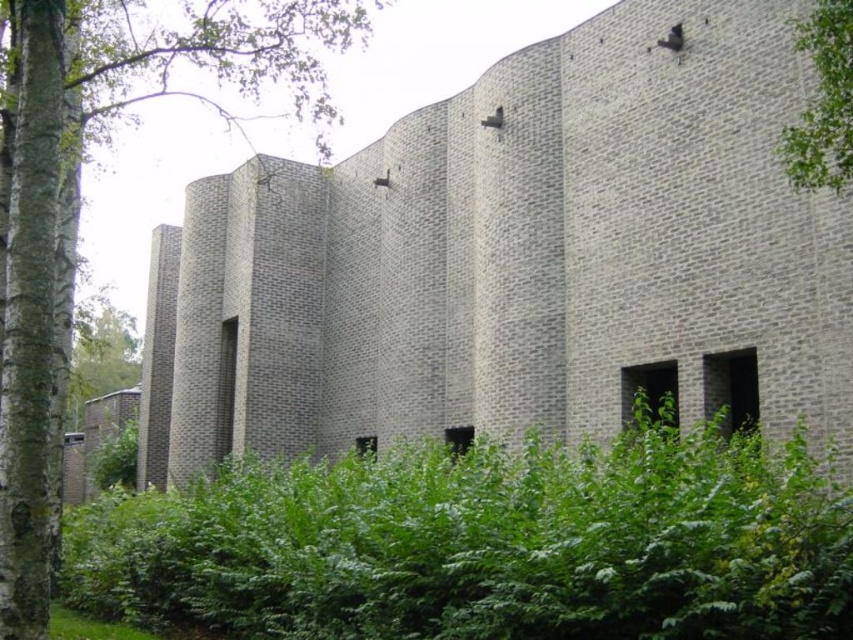
Consider the image. Who is shorter, green leafy tree at upper right or green leafy grass at lower left?

green leafy grass at lower left

Between green leafy tree at upper right and green leafy grass at lower left, which one has more height?

green leafy tree at upper right is taller.

You are a GUI agent. You are given a task and a screenshot of the screen. Output one action in this format:
    pyautogui.click(x=<x>, y=<y>)
    Task: Click on the green leafy tree at upper right
    The height and width of the screenshot is (640, 853).
    Given the screenshot: What is the action you would take?
    pyautogui.click(x=822, y=100)

At what (x,y) coordinates should I click in order to perform the action: click on green leafy tree at upper right. Please return your answer as a coordinate pair (x, y). Looking at the image, I should click on (822, 100).

Who is positioned more to the right, green leafy tree at left or green leafy tree at upper right?

green leafy tree at upper right

Does point (126, 19) come in front of point (838, 120)?

That is False.

I want to click on green leafy tree at left, so click(x=78, y=200).

Is green leafy tree at left bigger than green leafy grass at lower left?

Yes.

Between point (35, 333) and point (136, 636), which one is positioned in front?

Point (35, 333) is more forward.

This screenshot has height=640, width=853. In order to click on green leafy tree at left in this screenshot , I will do `click(78, 200)`.